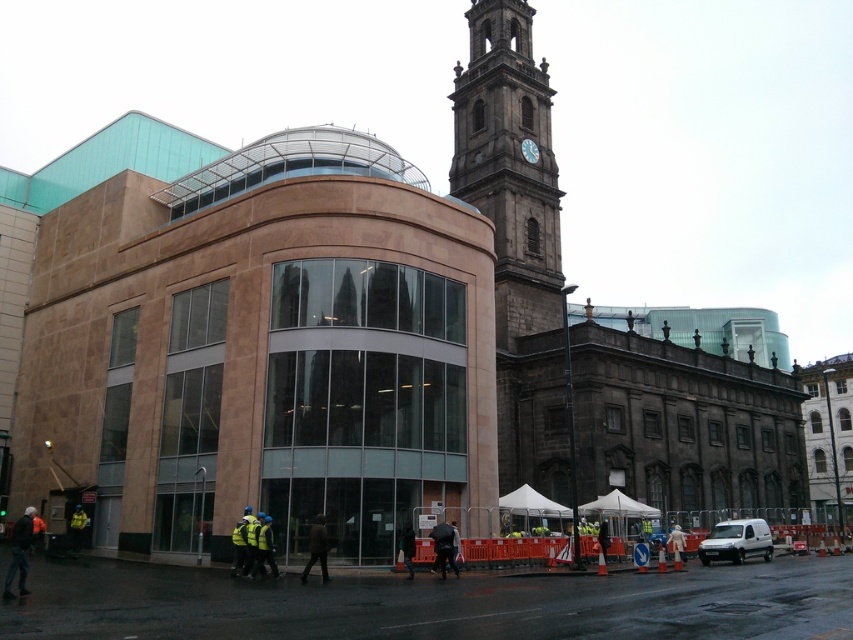
Between point (22, 516) and point (677, 540), which one is positioned in front?

Positioned in front is point (22, 516).

Who is more forward, (22, 561) or (682, 566)?

Point (22, 561)

Where is `dark gray jacket at lower left`? dark gray jacket at lower left is located at coordinates (19, 554).

Can you confirm if yellow reflective vest at lower center is thinner than white matte jacket at center?

Correct, yellow reflective vest at lower center's width is less than white matte jacket at center's.

Can you confirm if yellow reflective vest at lower center is bigger than white matte jacket at center?

Actually, yellow reflective vest at lower center might be smaller than white matte jacket at center.

Which is behind, point (259, 564) or point (672, 548)?

Point (672, 548)

Identify the location of yellow reflective vest at lower center. (265, 548).

Which is more to the left, dark brown leather jacket at center or white matte jacket at center?

Positioned to the left is dark brown leather jacket at center.

Is point (309, 554) farther from camera compared to point (672, 568)?

No.

Identify the location of dark brown leather jacket at center. (317, 548).